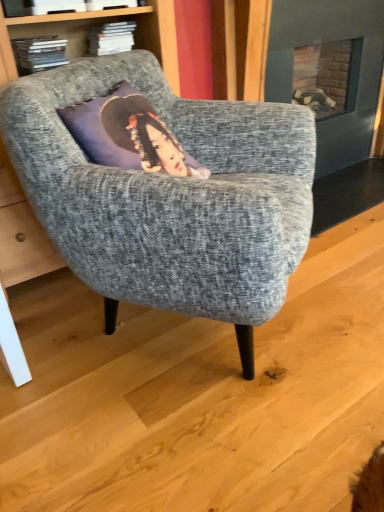
Question: Is textured gray armchair at center closer to the viewer compared to hardcover book at upper left?

Choices:
 (A) no
 (B) yes

Answer: (B)

Question: From a real-world perspective, is textured gray armchair at center over hardcover book at upper left?

Choices:
 (A) yes
 (B) no

Answer: (B)

Question: Would you say hardcover book at upper left is part of textured gray armchair at center's contents?

Choices:
 (A) no
 (B) yes

Answer: (A)

Question: From a real-world perspective, does textured gray armchair at center sit lower than hardcover book at upper left?

Choices:
 (A) no
 (B) yes

Answer: (B)

Question: Is textured gray armchair at center at the left side of hardcover book at upper left?

Choices:
 (A) yes
 (B) no

Answer: (B)

Question: Can you confirm if textured gray armchair at center is bigger than hardcover book at upper left?

Choices:
 (A) yes
 (B) no

Answer: (A)

Question: Is textured gray armchair at center at the back of hardcover book at upper left?

Choices:
 (A) yes
 (B) no

Answer: (B)

Question: Is hardcover book at upper left to the right of textured gray armchair at center from the viewer's perspective?

Choices:
 (A) yes
 (B) no

Answer: (B)

Question: Considering the relative sizes of hardcover book at upper left and textured gray armchair at center in the image provided, is hardcover book at upper left shorter than textured gray armchair at center?

Choices:
 (A) yes
 (B) no

Answer: (A)

Question: Would you say textured gray armchair at center is part of hardcover book at upper left's contents?

Choices:
 (A) no
 (B) yes

Answer: (A)

Question: Is hardcover book at upper left wider than textured gray armchair at center?

Choices:
 (A) yes
 (B) no

Answer: (B)

Question: Can you confirm if hardcover book at upper left is taller than textured gray armchair at center?

Choices:
 (A) no
 (B) yes

Answer: (A)

Question: Considering the positions of hardcover book at upper left and textured gray armchair at center in the image, is hardcover book at upper left bigger or smaller than textured gray armchair at center?

Choices:
 (A) small
 (B) big

Answer: (A)